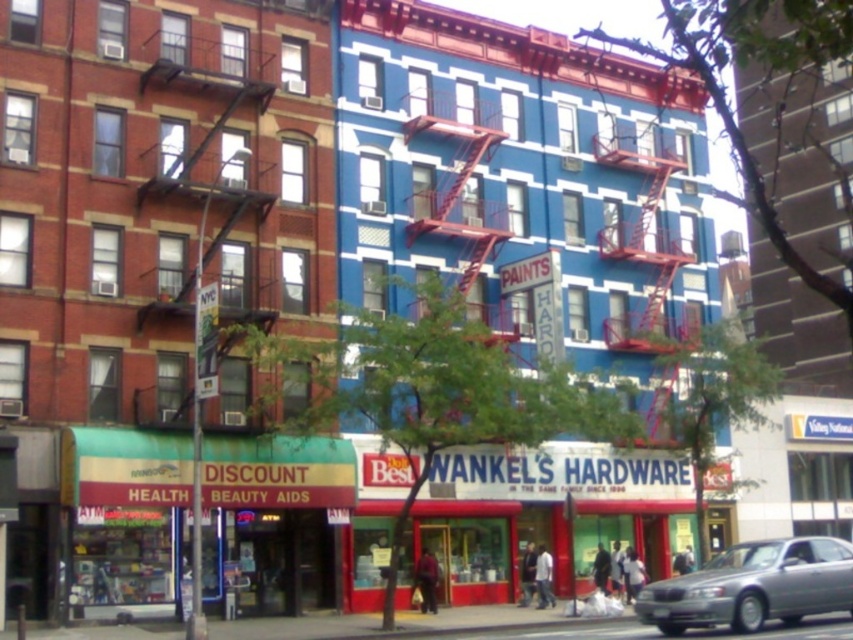
Question: Can you confirm if green fabric health aid store at lower left is positioned to the left of silver metallic car at lower right?

Choices:
 (A) yes
 (B) no

Answer: (A)

Question: Does green fabric health aid store at lower left have a lesser width compared to silver metallic car at lower right?

Choices:
 (A) yes
 (B) no

Answer: (B)

Question: Among these points, which one is nearest to the camera?

Choices:
 (A) (804, 608)
 (B) (262, 458)

Answer: (A)

Question: Which object appears closest to the camera in this image?

Choices:
 (A) silver metallic car at lower right
 (B) green fabric health aid store at lower left

Answer: (A)

Question: Can you confirm if green fabric health aid store at lower left is positioned above silver metallic car at lower right?

Choices:
 (A) no
 (B) yes

Answer: (B)